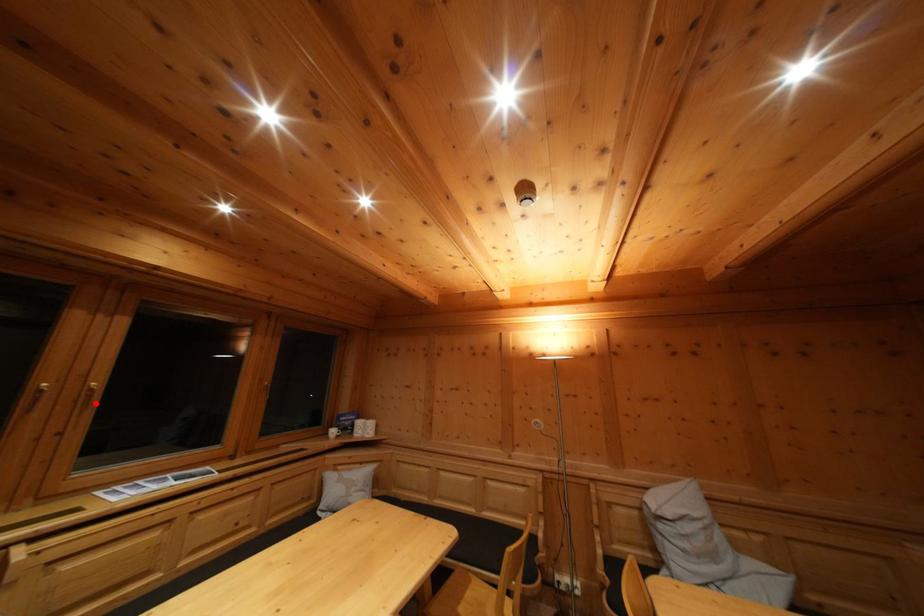
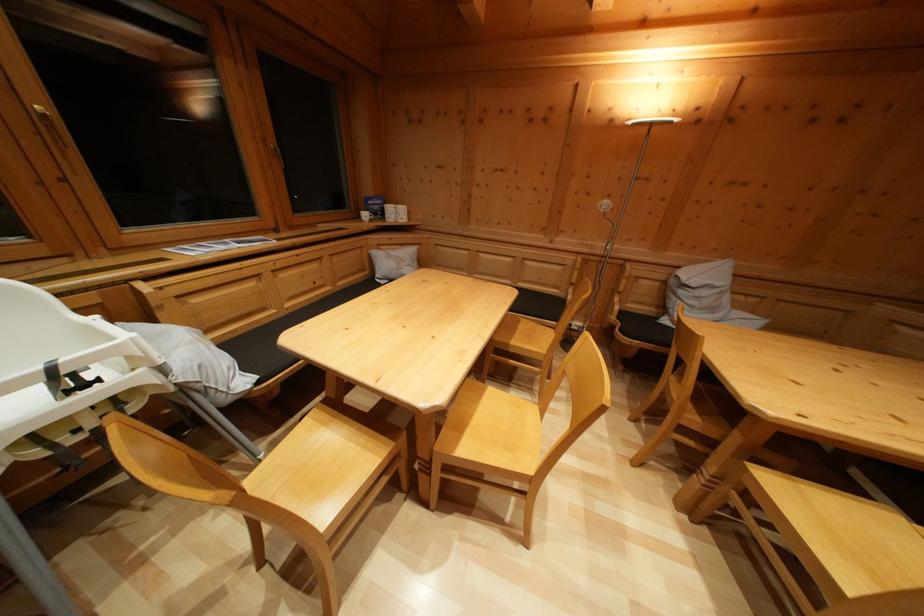
Question: I am providing you with two images of the same scene from different viewpoints. Given a red point in image1, look at the same physical point in image2. Is it:

Choices:
 (A) Closer to the viewpoint
 (B) Farther from the viewpoint

Answer: (B)